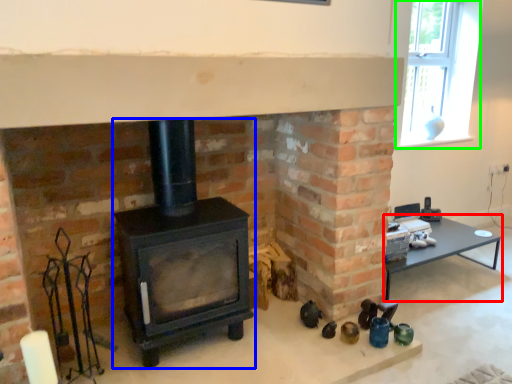
Question: Considering the real-world distances, which object is closest to table (highlighted by a red box)? wood burning stove (highlighted by a blue box) or window (highlighted by a green box).

Choices:
 (A) wood burning stove
 (B) window

Answer: (B)